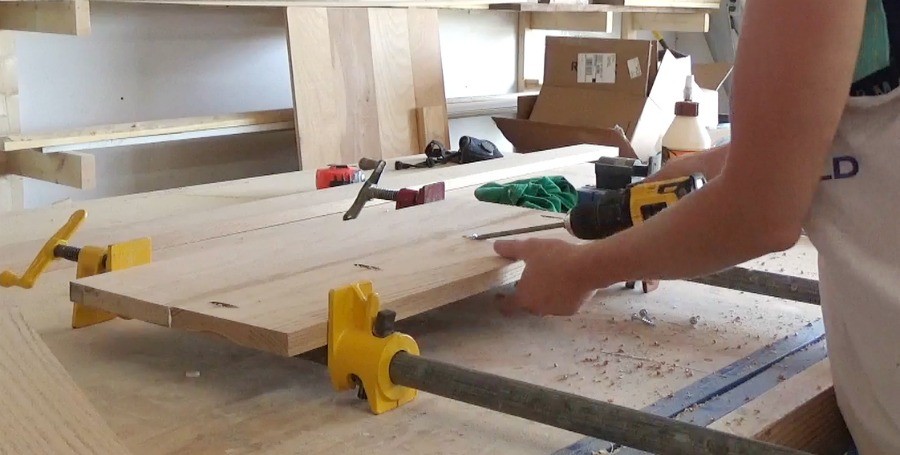
The width and height of the screenshot is (900, 455). I want to click on rod, so click(x=446, y=370), click(x=749, y=284).